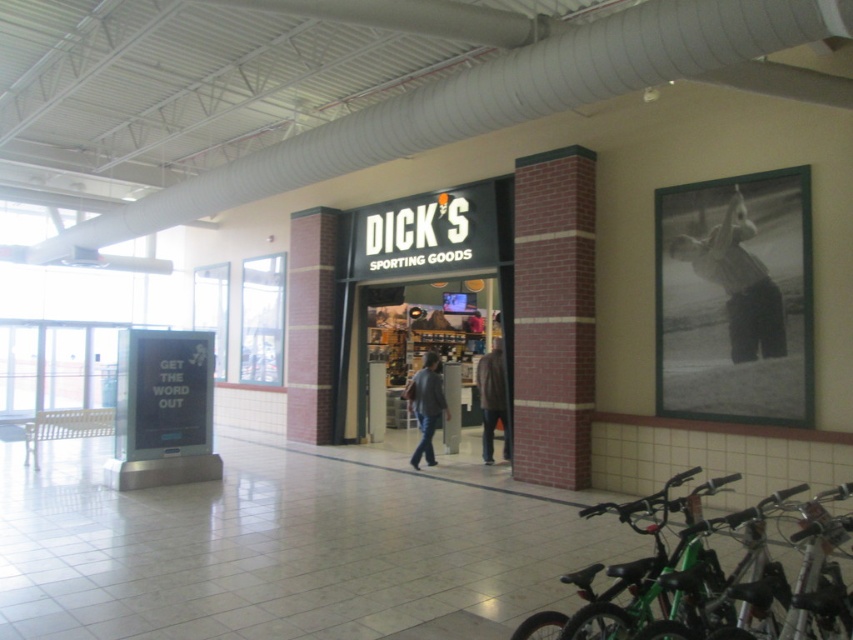
Is green matte bicycle at lower right positioned before black matte dick's sporting goods at center?

That is True.

Does green matte bicycle at lower right have a greater height compared to black matte dick's sporting goods at center?

No, green matte bicycle at lower right is not taller than black matte dick's sporting goods at center.

Is point (666, 554) behind point (508, 202)?

No.

This screenshot has height=640, width=853. Find the location of `green matte bicycle at lower right`. green matte bicycle at lower right is located at coordinates (711, 576).

Who is positioned more to the right, black matte dick's sporting goods at center or denim jacket at center?

black matte dick's sporting goods at center is more to the right.

Is black matte dick's sporting goods at center to the left of denim jacket at center from the viewer's perspective?

No, black matte dick's sporting goods at center is not to the left of denim jacket at center.

I want to click on black matte dick's sporting goods at center, so click(431, 275).

Between green matte bicycle at lower right and dark brown jacket at center, which one has more height?

With more height is dark brown jacket at center.

How much distance is there between green matte bicycle at lower right and dark brown jacket at center?

6.87 meters

Is point (556, 632) closer to viewer compared to point (486, 404)?

Yes, point (556, 632) is in front of point (486, 404).

Where is `green matte bicycle at lower right`? green matte bicycle at lower right is located at coordinates (711, 576).